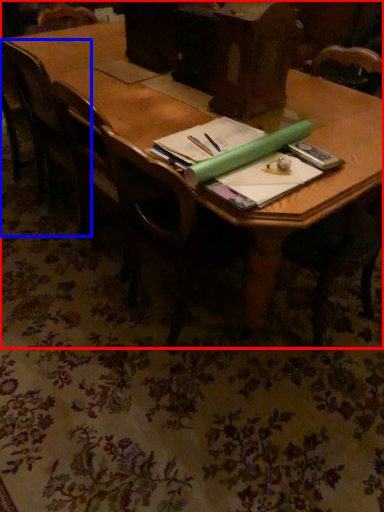
Question: Which point is further to the camera, table (highlighted by a red box) or chair (highlighted by a blue box)?

Choices:
 (A) table
 (B) chair

Answer: (B)